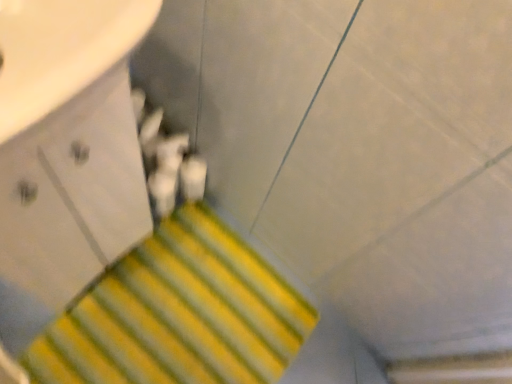
Describe the element at coordinates (179, 314) in the screenshot. I see `yellow striped carpet at lower center` at that location.

Image resolution: width=512 pixels, height=384 pixels. I want to click on yellow striped carpet at lower center, so click(x=179, y=314).

Measure the distance between yellow striped carpet at lower center and camera.

They are 38.46 inches apart.

Describe the element at coordinates (68, 205) in the screenshot. I see `white glossy drawer at upper left` at that location.

The image size is (512, 384). I want to click on white glossy drawer at upper left, so click(x=68, y=205).

Locate an element on the screen. The image size is (512, 384). yellow striped carpet at lower center is located at coordinates (179, 314).

Visually, is yellow striped carpet at lower center positioned to the left or to the right of white glossy drawer at upper left?

Clearly, yellow striped carpet at lower center is on the right of white glossy drawer at upper left in the image.

Is the depth of yellow striped carpet at lower center less than that of white glossy drawer at upper left?

No, yellow striped carpet at lower center is behind white glossy drawer at upper left.

Between point (251, 383) and point (1, 290), which one is positioned in front?

The point (1, 290) is in front.

From the image's perspective, does yellow striped carpet at lower center appear higher than white glossy drawer at upper left?

No, from the image's perspective, yellow striped carpet at lower center is not over white glossy drawer at upper left.

From a real-world perspective, is yellow striped carpet at lower center positioned above or below white glossy drawer at upper left?

From a real-world perspective, yellow striped carpet at lower center is physically below white glossy drawer at upper left.

Which object is wider, yellow striped carpet at lower center or white glossy drawer at upper left?

yellow striped carpet at lower center is wider.

Between yellow striped carpet at lower center and white glossy drawer at upper left, which one has less height?

yellow striped carpet at lower center is shorter.

Is yellow striped carpet at lower center bigger or smaller than white glossy drawer at upper left?

Considering their sizes, yellow striped carpet at lower center takes up less space than white glossy drawer at upper left.

Is yellow striped carpet at lower center not inside white glossy drawer at upper left?

Indeed, yellow striped carpet at lower center is completely outside white glossy drawer at upper left.

Is yellow striped carpet at lower center far away from white glossy drawer at upper left?

That's not correct — yellow striped carpet at lower center is a little close to white glossy drawer at upper left.

Is yellow striped carpet at lower center aimed at white glossy drawer at upper left?

No, yellow striped carpet at lower center is not aimed at white glossy drawer at upper left.

Locate an element on the screen. drawer in front of the yellow striped carpet at lower center is located at coordinates (68, 205).

Based on the photo, considering the positions of objects white glossy drawer at upper left and yellow striped carpet at lower center in the image provided, who is more to the right, white glossy drawer at upper left or yellow striped carpet at lower center?

yellow striped carpet at lower center is more to the right.

Is the position of white glossy drawer at upper left less distant than that of yellow striped carpet at lower center?

Yes, the depth of white glossy drawer at upper left is less than that of yellow striped carpet at lower center.

Between point (91, 123) and point (318, 316), which one is positioned in front?

The point (91, 123) is closer to the camera.

From the image's perspective, between white glossy drawer at upper left and yellow striped carpet at lower center, who is located below?

yellow striped carpet at lower center, from the image's perspective.

From a real-world perspective, which object stands above the other?

white glossy drawer at upper left.

Considering the relative sizes of white glossy drawer at upper left and yellow striped carpet at lower center in the image provided, is white glossy drawer at upper left wider than yellow striped carpet at lower center?

No, white glossy drawer at upper left is not wider than yellow striped carpet at lower center.

Is white glossy drawer at upper left shorter than yellow striped carpet at lower center?

Incorrect, the height of white glossy drawer at upper left does not fall short of that of yellow striped carpet at lower center.

Does white glossy drawer at upper left have a larger size compared to yellow striped carpet at lower center?

Indeed, white glossy drawer at upper left has a larger size compared to yellow striped carpet at lower center.

Looking at this image, is yellow striped carpet at lower center a part of white glossy drawer at upper left?

That's incorrect, yellow striped carpet at lower center is not inside white glossy drawer at upper left.

Is white glossy drawer at upper left beside yellow striped carpet at lower center?

No.

Based on the photo, does white glossy drawer at upper left turn towards yellow striped carpet at lower center?

No, white glossy drawer at upper left is not oriented towards yellow striped carpet at lower center.

How many degrees apart are the facing directions of white glossy drawer at upper left and yellow striped carpet at lower center?

92.1 degrees.

Locate an element on the screen. This screenshot has height=384, width=512. drawer above the yellow striped carpet at lower center (from the image's perspective) is located at coordinates (68, 205).

Identify the location of drawer located above the yellow striped carpet at lower center (from a real-world perspective). The image size is (512, 384). (68, 205).

The image size is (512, 384). I want to click on stairs directly beneath the white glossy drawer at upper left (from a real-world perspective), so click(x=179, y=314).